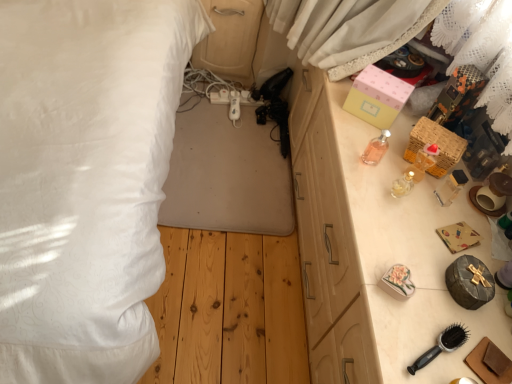
Image resolution: width=512 pixels, height=384 pixels. Identify the location of vacant area that lies to the right of black plastic hairbrush at lower right. (475, 342).